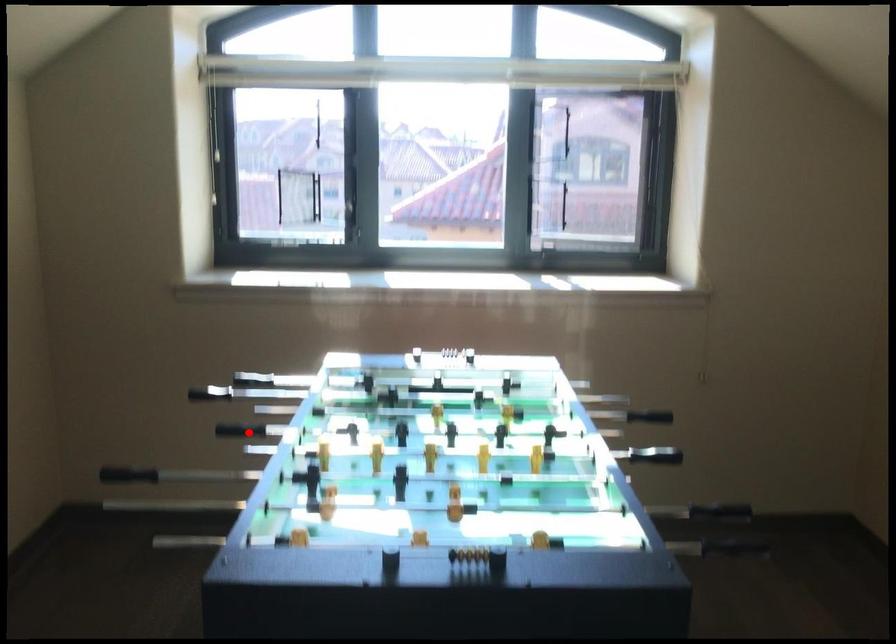
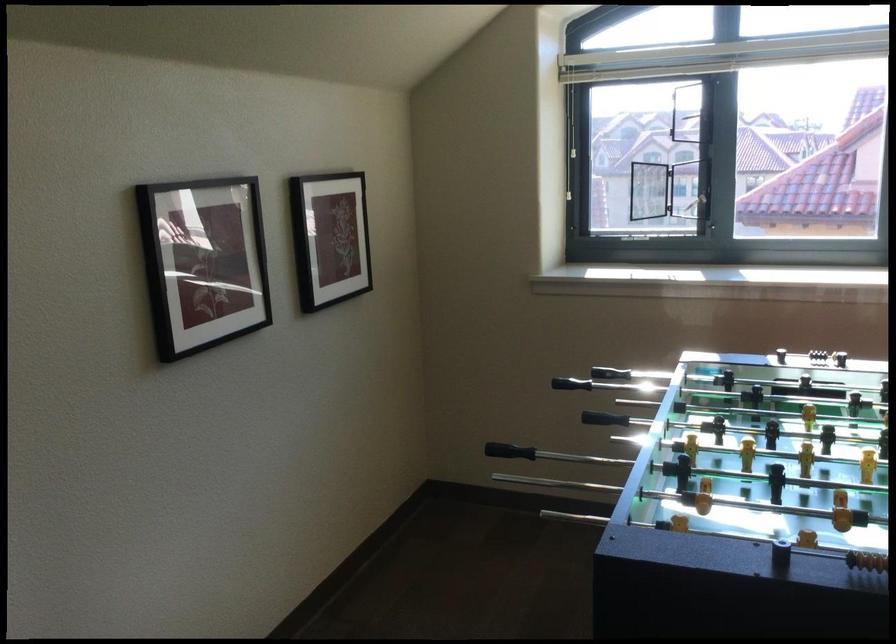
In the second image, find the point that corresponds to the highlighted location in the first image.

(604, 419)